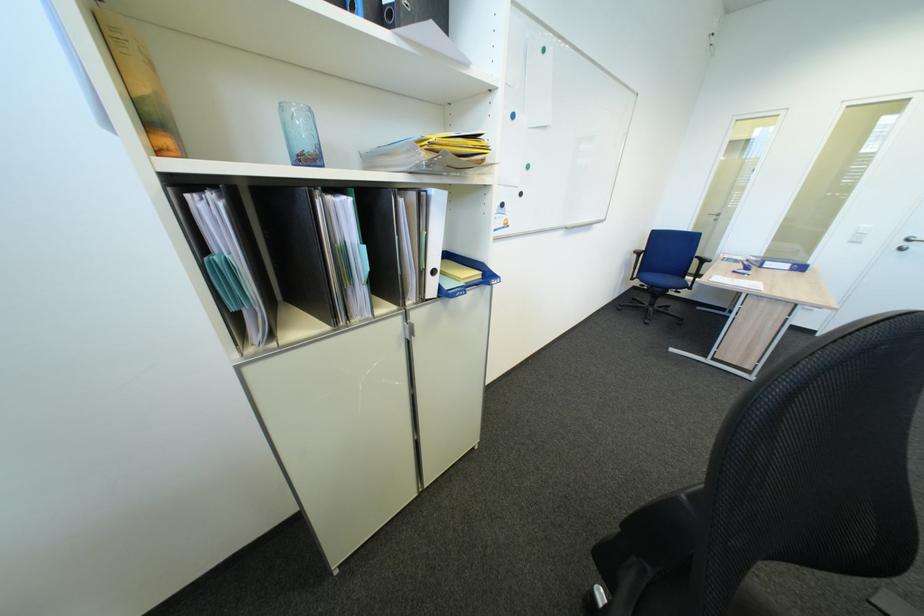
The height and width of the screenshot is (616, 924). What are the coordinates of `blue chair armrest` in the screenshot? It's located at (699, 264).